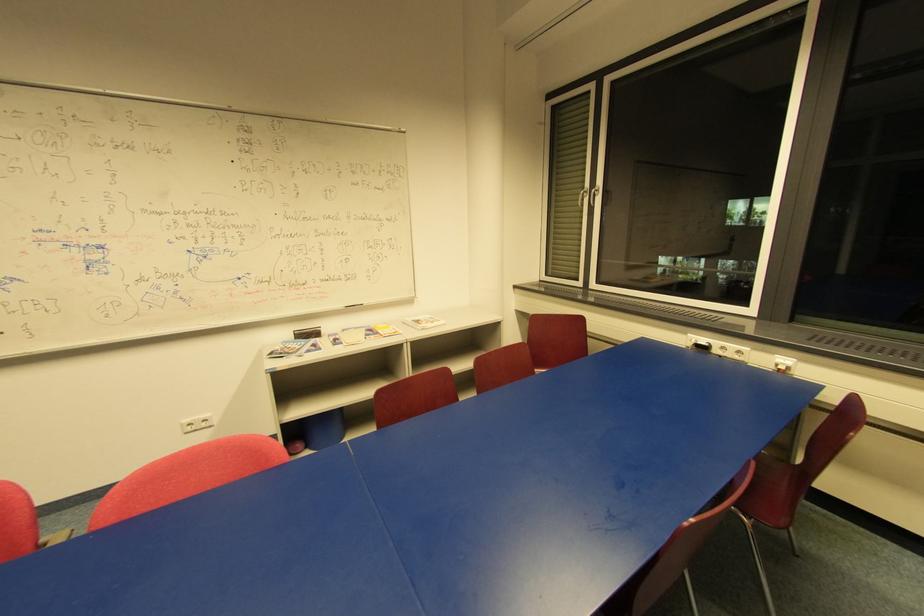
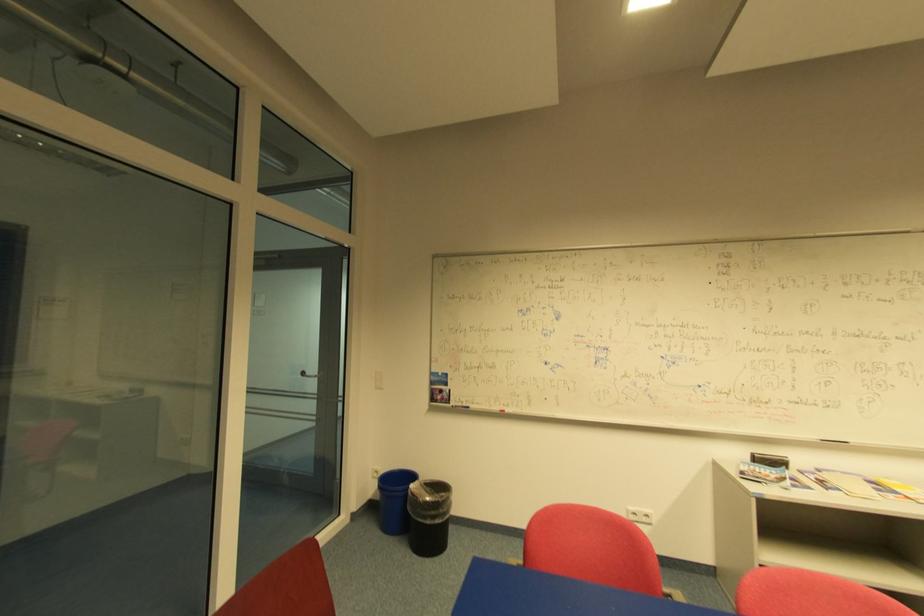
Question: The first image is from the beginning of the video and the second image is from the end. How did the camera likely rotate when shooting the video?

Choices:
 (A) Left
 (B) Right
 (C) Up
 (D) Down

Answer: (A)